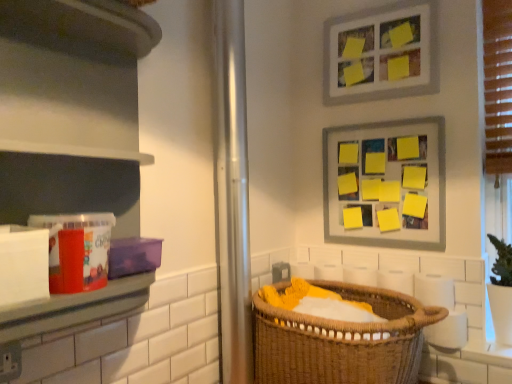
What do you see at coordinates (342, 341) in the screenshot? I see `brown woven basket at lower center` at bounding box center [342, 341].

What is the approximate height of metallic silver screen door at center?

metallic silver screen door at center is 4.32 feet in height.

The image size is (512, 384). What do you see at coordinates (380, 54) in the screenshot?
I see `matte gray picture frame at upper center, which is counted as the second picture frame, starting from the bottom` at bounding box center [380, 54].

Locate an element on the screen. yellow paper/magnetic board at upper right, marked as the second picture frame in a top-to-bottom arrangement is located at coordinates (387, 183).

From the image's perspective, is yellow paper/magnetic board at upper right, marked as the second picture frame in a top-to-bottom arrangement, above or below matte plastic container at left?

From the image's perspective, yellow paper/magnetic board at upper right, marked as the second picture frame in a top-to-bottom arrangement, appears below matte plastic container at left.

In terms of width, does yellow paper/magnetic board at upper right, marked as the second picture frame in a top-to-bottom arrangement, look wider or thinner when compared to matte plastic container at left?

yellow paper/magnetic board at upper right, marked as the second picture frame in a top-to-bottom arrangement, is thinner than matte plastic container at left.

Would you say yellow paper/magnetic board at upper right, marked as the second picture frame in a top-to-bottom arrangement, is inside or outside matte plastic container at left?

The correct answer is: outside.

What are the coordinates of `screen door on the left of the yellow paper/magnetic board at upper right, marked as the second picture frame in a top-to-bottom arrangement` in the screenshot? It's located at (232, 194).

Considering their positions, is metallic silver screen door at center located in front of or behind yellow paper/magnetic board at upper right, marked as the second picture frame in a top-to-bottom arrangement?

Clearly, metallic silver screen door at center is in front of yellow paper/magnetic board at upper right, marked as the second picture frame in a top-to-bottom arrangement.

Is point (225, 51) farther from viewer compared to point (426, 208)?

No, it is in front of (426, 208).

From the image's perspective, is metallic silver screen door at center beneath yellow paper/magnetic board at upper right, marked as the second picture frame in a top-to-bottom arrangement?

Yes, from the image's perspective, metallic silver screen door at center is below yellow paper/magnetic board at upper right, marked as the second picture frame in a top-to-bottom arrangement.

Is matte gray picture frame at upper center, which is counted as the second picture frame, starting from the bottom, positioned beyond the bounds of matte plastic container at left?

matte gray picture frame at upper center, which is counted as the second picture frame, starting from the bottom, is positioned outside matte plastic container at left.

Where is `picture frame above the matte plastic container at left (from the image's perspective)`? picture frame above the matte plastic container at left (from the image's perspective) is located at coordinates (380, 54).

Is matte gray picture frame at upper center, which is the 1th picture frame in top-to-bottom order, positioned far away from matte plastic container at left?

That's right, there is a large distance between matte gray picture frame at upper center, which is the 1th picture frame in top-to-bottom order, and matte plastic container at left.

From a real-world perspective, is matte gray picture frame at upper center, which is the 1th picture frame in top-to-bottom order, physically below matte plastic container at left?

No, from a real-world perspective, matte gray picture frame at upper center, which is the 1th picture frame in top-to-bottom order, is not below matte plastic container at left.

Is brown woven basket at lower center far from matte plastic container at left?

No.

Which is closer, (333, 346) or (58, 205)?

Positioned in front is point (58, 205).

Who is shorter, brown woven basket at lower center or matte plastic container at left?

brown woven basket at lower center is shorter.

Which is more to the right, brown woven basket at lower center or matte plastic container at left?

brown woven basket at lower center.

Is matte plastic container at left to the left of metallic silver screen door at center from the viewer's perspective?

Yes.

Considering the relative positions of matte plastic container at left and metallic silver screen door at center in the image provided, is matte plastic container at left in front of metallic silver screen door at center?

Yes, matte plastic container at left is closer to the viewer.

From the image's perspective, which is below, matte plastic container at left or metallic silver screen door at center?

metallic silver screen door at center.

From a real-world perspective, does matte plastic container at left stand above metallic silver screen door at center?

Yes, from a real-world perspective, matte plastic container at left is over metallic silver screen door at center

Is brown woven basket at lower center not inside yellow paper/magnetic board at upper right, marked as the second picture frame in a top-to-bottom arrangement?

Yes.

Is brown woven basket at lower center at the left side of yellow paper/magnetic board at upper right, which is the 1th picture frame from bottom to top?

Yes, brown woven basket at lower center is to the left of yellow paper/magnetic board at upper right, which is the 1th picture frame from bottom to top.

Is brown woven basket at lower center oriented away from yellow paper/magnetic board at upper right, which is the 1th picture frame from bottom to top?

No, yellow paper/magnetic board at upper right, which is the 1th picture frame from bottom to top, is not at the back of brown woven basket at lower center.

Consider the image. Are brown woven basket at lower center and yellow paper/magnetic board at upper right, marked as the second picture frame in a top-to-bottom arrangement, beside each other?

No, brown woven basket at lower center is not making contact with yellow paper/magnetic board at upper right, marked as the second picture frame in a top-to-bottom arrangement.

From the image's perspective, does yellow paper/magnetic board at upper right, which is the 1th picture frame from bottom to top, appear lower than metallic silver screen door at center?

No.

Can you confirm if yellow paper/magnetic board at upper right, which is the 1th picture frame from bottom to top, is taller than metallic silver screen door at center?

In fact, yellow paper/magnetic board at upper right, which is the 1th picture frame from bottom to top, may be shorter than metallic silver screen door at center.

Considering the relative sizes of yellow paper/magnetic board at upper right, which is the 1th picture frame from bottom to top, and metallic silver screen door at center in the image provided, is yellow paper/magnetic board at upper right, which is the 1th picture frame from bottom to top, smaller than metallic silver screen door at center?

Indeed, yellow paper/magnetic board at upper right, which is the 1th picture frame from bottom to top, has a smaller size compared to metallic silver screen door at center.

Is yellow paper/magnetic board at upper right, which is the 1th picture frame from bottom to top, oriented towards metallic silver screen door at center?

Yes, yellow paper/magnetic board at upper right, which is the 1th picture frame from bottom to top, is aimed at metallic silver screen door at center.

This screenshot has width=512, height=384. What are the coordinates of `cabinet above the yellow paper/magnetic board at upper right, which is the 1th picture frame from bottom to top (from a real-world perspective)` in the screenshot? It's located at (71, 108).

From the metallic silver screen door at center, count 2nd picture frame to the right and point to it. Please provide its 2D coordinates.

[(387, 183)]

Looking at the image, which one is located further to metallic silver screen door at center, brown woven basket at lower center or yellow paper/magnetic board at upper right, which is the 1th picture frame from bottom to top?

The object further to metallic silver screen door at center is yellow paper/magnetic board at upper right, which is the 1th picture frame from bottom to top.

In the scene shown: Which object lies further to the anchor point matte gray picture frame at upper center, which is counted as the second picture frame, starting from the bottom, brown woven basket at lower center or metallic silver screen door at center?

brown woven basket at lower center is positioned further to the anchor matte gray picture frame at upper center, which is counted as the second picture frame, starting from the bottom.

From the image, which object appears to be farther from matte plastic container at left, yellow paper/magnetic board at upper right, which is the 1th picture frame from bottom to top, or metallic silver screen door at center?

The object further to matte plastic container at left is yellow paper/magnetic board at upper right, which is the 1th picture frame from bottom to top.

Estimate the real-world distances between objects in this image. Which object is further from matte plastic container at left, metallic silver screen door at center or brown woven basket at lower center?

brown woven basket at lower center.

Which object lies nearer to the anchor point matte plastic container at left, matte gray picture frame at upper center, which is the 1th picture frame in top-to-bottom order, or brown woven basket at lower center?

brown woven basket at lower center.

Based on the photo, estimate the real-world distances between objects in this image. Which object is further from matte plastic container at left, brown woven basket at lower center or yellow paper/magnetic board at upper right, which is the 1th picture frame from bottom to top?

The object further to matte plastic container at left is yellow paper/magnetic board at upper right, which is the 1th picture frame from bottom to top.

Looking at this image, based on their spatial positions, is matte plastic container at left or brown woven basket at lower center further from yellow paper/magnetic board at upper right, which is the 1th picture frame from bottom to top?

Based on the image, matte plastic container at left appears to be further to yellow paper/magnetic board at upper right, which is the 1th picture frame from bottom to top.

From the image, which object appears to be nearer to matte plastic container at left, matte gray picture frame at upper center, which is counted as the second picture frame, starting from the bottom, or yellow paper/magnetic board at upper right, marked as the second picture frame in a top-to-bottom arrangement?

yellow paper/magnetic board at upper right, marked as the second picture frame in a top-to-bottom arrangement, is closer to matte plastic container at left.

Find the location of a particular element. This screenshot has width=512, height=384. screen door between matte plastic container at left and matte gray picture frame at upper center, which is the 1th picture frame in top-to-bottom order, in the horizontal direction is located at coordinates (232, 194).

Image resolution: width=512 pixels, height=384 pixels. What are the coordinates of `basket situated between metallic silver screen door at center and yellow paper/magnetic board at upper right, marked as the second picture frame in a top-to-bottom arrangement, from left to right` in the screenshot? It's located at (342, 341).

What are the coordinates of `basket between matte plastic container at left and yellow paper/magnetic board at upper right, marked as the second picture frame in a top-to-bottom arrangement, from left to right` in the screenshot? It's located at click(342, 341).

This screenshot has width=512, height=384. I want to click on picture frame located between metallic silver screen door at center and yellow paper/magnetic board at upper right, marked as the second picture frame in a top-to-bottom arrangement, in the left-right direction, so click(380, 54).